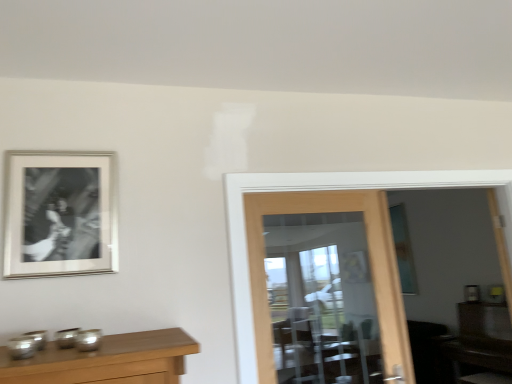
What do you see at coordinates (370, 258) in the screenshot? This screenshot has width=512, height=384. I see `clear glass door at center` at bounding box center [370, 258].

This screenshot has width=512, height=384. What do you see at coordinates (482, 343) in the screenshot?
I see `brown wooden dresser at lower right` at bounding box center [482, 343].

You are a GUI agent. You are given a task and a screenshot of the screen. Output one action in this format:
    pyautogui.click(x=<x>, y=<y>)
    Task: Click on the clear glass door at center
    Image resolution: width=512 pixels, height=384 pixels.
    Given the screenshot: What is the action you would take?
    pyautogui.click(x=370, y=258)

Considering the sizes of clear glass door at center and silver/metallic photo frame at upper left in the image, is clear glass door at center wider or thinner than silver/metallic photo frame at upper left?

Considering their sizes, clear glass door at center looks broader than silver/metallic photo frame at upper left.

Does clear glass door at center have a greater height compared to silver/metallic photo frame at upper left?

Correct, clear glass door at center is much taller as silver/metallic photo frame at upper left.

From the image's perspective, is clear glass door at center under silver/metallic photo frame at upper left?

Yes, from the image's perspective, clear glass door at center is below silver/metallic photo frame at upper left.

From a real-world perspective, who is located lower, clear glass door at center or silver/metallic photo frame at upper left?

clear glass door at center.

In terms of height, does brown wooden dresser at lower right look taller or shorter compared to silver/metallic photo frame at upper left?

Clearly, brown wooden dresser at lower right is taller compared to silver/metallic photo frame at upper left.

Is brown wooden dresser at lower right far away from silver/metallic photo frame at upper left?

That's right, there is a large distance between brown wooden dresser at lower right and silver/metallic photo frame at upper left.

Is brown wooden dresser at lower right looking in the opposite direction of silver/metallic photo frame at upper left?

That's right, brown wooden dresser at lower right is facing away from silver/metallic photo frame at upper left.

Is silver/metallic photo frame at upper left facing towards clear glass door at center?

No, silver/metallic photo frame at upper left does not turn towards clear glass door at center.

Which is more to the left, silver/metallic photo frame at upper left or clear glass door at center?

silver/metallic photo frame at upper left is more to the left.

Based on the photo, is silver/metallic photo frame at upper left not near clear glass door at center?

silver/metallic photo frame at upper left is actually quite close to clear glass door at center.

Does brown wooden dresser at lower right turn towards clear glass door at center?

No, brown wooden dresser at lower right does not turn towards clear glass door at center.

Consider the image. From a real-world perspective, is brown wooden dresser at lower right on clear glass door at center?

No, from a real-world perspective, brown wooden dresser at lower right is not over clear glass door at center

Between brown wooden dresser at lower right and clear glass door at center, which one has less height?

brown wooden dresser at lower right.

How distant is brown wooden dresser at lower right from clear glass door at center?

brown wooden dresser at lower right is 2.51 meters from clear glass door at center.

Considering the sizes of objects clear glass door at center and brown wooden dresser at lower right in the image provided, who is bigger, clear glass door at center or brown wooden dresser at lower right?

Bigger between the two is brown wooden dresser at lower right.

From the image's perspective, which is above, clear glass door at center or brown wooden dresser at lower right?

From the image's view, clear glass door at center is above.

The height and width of the screenshot is (384, 512). I want to click on dresser directly beneath the clear glass door at center (from a real-world perspective), so click(x=482, y=343).

In terms of height, does clear glass door at center look taller or shorter compared to brown wooden dresser at lower right?

In the image, clear glass door at center appears to be taller than brown wooden dresser at lower right.

Is silver/metallic photo frame at upper left closer to the viewer compared to brown wooden dresser at lower right?

Yes, silver/metallic photo frame at upper left is in front of brown wooden dresser at lower right.

I want to click on dresser that is under the silver/metallic photo frame at upper left (from a real-world perspective), so click(482, 343).

Considering the relative sizes of silver/metallic photo frame at upper left and brown wooden dresser at lower right in the image provided, is silver/metallic photo frame at upper left smaller than brown wooden dresser at lower right?

Correct, silver/metallic photo frame at upper left occupies less space than brown wooden dresser at lower right.

Consider the image. From a real-world perspective, which object rests below the other?

From a 3D spatial view, brown wooden dresser at lower right is below.

This screenshot has height=384, width=512. What are the coordinates of `door behind the silver/metallic photo frame at upper left` in the screenshot? It's located at (x=370, y=258).

You are a GUI agent. You are given a task and a screenshot of the screen. Output one action in this format:
    pyautogui.click(x=<x>, y=<y>)
    Task: Click on the dresser that appears below the silver/metallic photo frame at upper left (from the image's perspective)
    The width and height of the screenshot is (512, 384).
    Given the screenshot: What is the action you would take?
    pyautogui.click(x=482, y=343)

From the image, which object appears to be nearer to silver/metallic photo frame at upper left, clear glass door at center or brown wooden dresser at lower right?

clear glass door at center.

In the scene shown: Estimate the real-world distances between objects in this image. Which object is closer to silver/metallic photo frame at upper left, brown wooden dresser at lower right or clear glass door at center?

clear glass door at center lies closer to silver/metallic photo frame at upper left than the other object.

Looking at the image, which one is located closer to brown wooden dresser at lower right, clear glass door at center or silver/metallic photo frame at upper left?

clear glass door at center is closer to brown wooden dresser at lower right.

Looking at this image, when comparing their distances from clear glass door at center, does brown wooden dresser at lower right or silver/metallic photo frame at upper left seem closer?

silver/metallic photo frame at upper left is positioned closer to the anchor clear glass door at center.

Estimate the real-world distances between objects in this image. Which object is further from clear glass door at center, silver/metallic photo frame at upper left or brown wooden dresser at lower right?

brown wooden dresser at lower right.

Estimate the real-world distances between objects in this image. Which object is closer to brown wooden dresser at lower right, silver/metallic photo frame at upper left or clear glass door at center?

clear glass door at center is positioned closer to the anchor brown wooden dresser at lower right.

The image size is (512, 384). Identify the location of door between silver/metallic photo frame at upper left and brown wooden dresser at lower right from left to right. (370, 258).